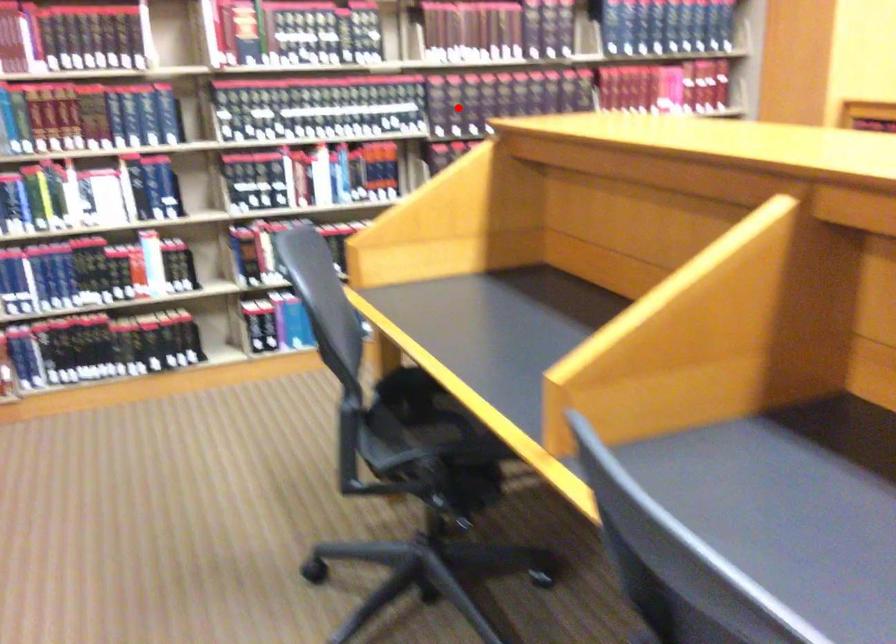
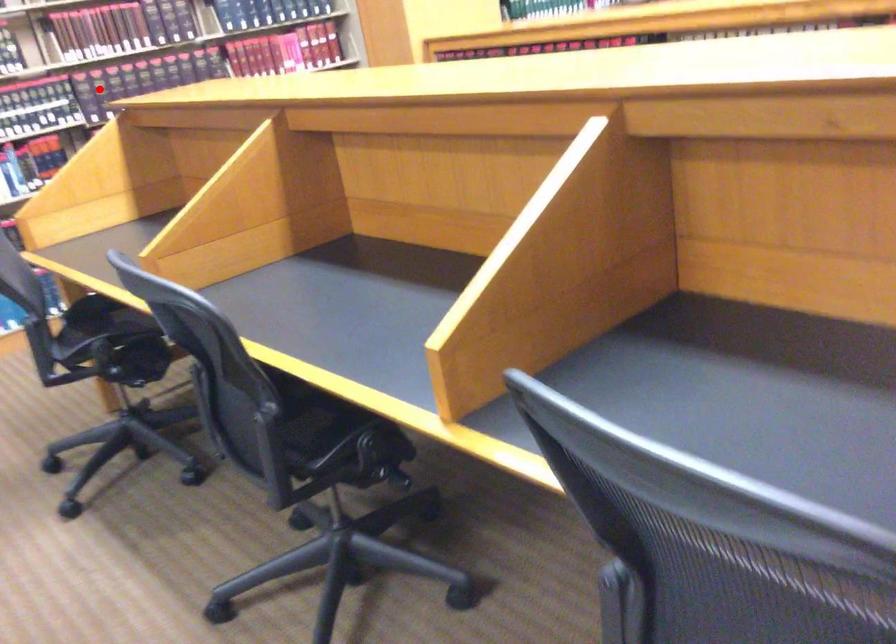
I am providing you with two images of the same scene from different viewpoints. A red point is marked on the first image and another point is marked on the second image. Is the red point in image1 aligned with the point shown in image2?

Yes